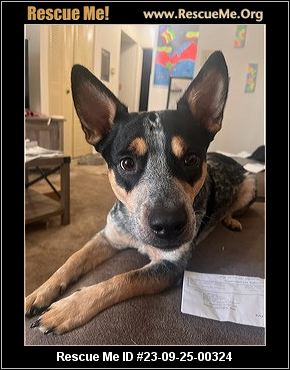
Identify the location of carpet. (152, 303).